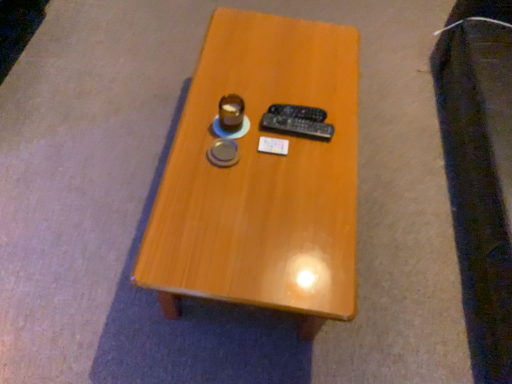
What are the coordinates of `vacant space behind black plastic remote control at center, which is counted as the second remote control, starting from the back` in the screenshot? It's located at (296, 86).